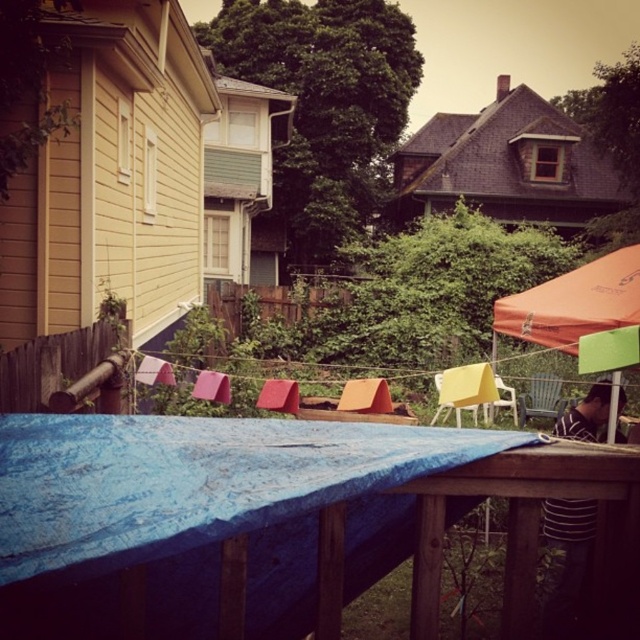
You are standing at the center of the wooden table covered with a blue tarp. You want to reach the striped shirt at lower right. Which direction should you move to get there?

Since the striped shirt at lower right is located at point (566, 560), you should move towards the lower right direction from the center of the wooden table covered with a blue tarp to reach it.

You are a delivery person carrying a package that is 8 meters long. You need to navigate through the backyard between the brown wooden fence at left and the wooden chair at right. Can you pass through this space without tilting the package?

The distance between the brown wooden fence at left and the wooden chair at right is 7.89 meters. Since the package is 8 meters long, it is slightly longer than the available space. Therefore, you cannot pass through without tilting or adjusting the package to shorten its length.

You are planning to set up a small tent in the backyard. You want to place it between the orange fabric canopy at upper right and the wooden chair at right. Can you do that?

The orange fabric canopy at upper right is closer to the viewer than the wooden chair at right, so you can place the tent between them as they are positioned at different distances from you.